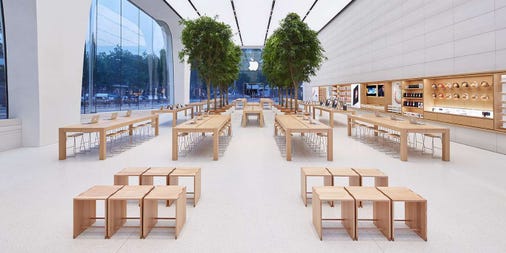
The width and height of the screenshot is (506, 253). In order to click on chairs in this screenshot , I will do `click(156, 218)`.